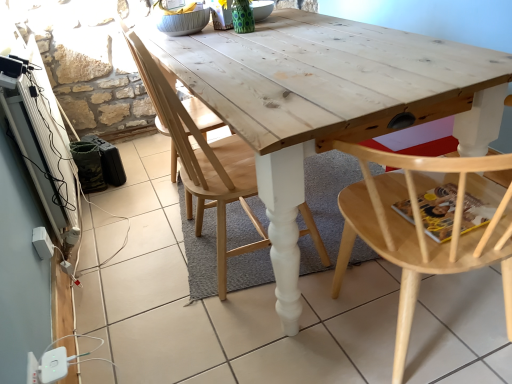
Identify the location of natural wood table at center. Image resolution: width=512 pixels, height=384 pixels. (328, 101).

At what (x,y) coordinates should I click in order to perform the action: click on natural wood chair at center, which is the second chair in right-to-left order. Please return your answer as a coordinate pair (x, y). This screenshot has width=512, height=384. Looking at the image, I should click on (203, 163).

Is natural wood chair at center, which ranks as the third chair in left-to-right order, at the back of natural wood table at center?

No, natural wood table at center's orientation is not away from natural wood chair at center, which ranks as the third chair in left-to-right order.

Does natural wood table at center have a greater height compared to natural wood chair at center, which ranks as the third chair in left-to-right order?

No, natural wood table at center is not taller than natural wood chair at center, which ranks as the third chair in left-to-right order.

What's the angular difference between natural wood table at center and natural wood chair at center, which ranks as the third chair in left-to-right order,'s facing directions?

The facing directions of natural wood table at center and natural wood chair at center, which ranks as the third chair in left-to-right order, are 89.8 degrees apart.

From a real-world perspective, is natural wood table at center positioned under natural wood chair at center, acting as the 1th chair starting from the right, based on gravity?

Correct, in the physical world, natural wood table at center is lower than natural wood chair at center, acting as the 1th chair starting from the right.

From a real-world perspective, who is located lower, natural wood chair at center, which appears as the 2th chair when viewed from the left, or natural wood table at center?

natural wood table at center, from a real-world perspective.

Is natural wood chair at center, which appears as the 2th chair when viewed from the left, further to the viewer compared to natural wood table at center?

Yes, natural wood chair at center, which appears as the 2th chair when viewed from the left, is further from the viewer.

From the image's perspective, relative to natural wood table at center, is natural wood chair at center, which is the second chair in right-to-left order, above or below?

From the image's perspective, natural wood chair at center, which is the second chair in right-to-left order, appears above natural wood table at center.

Who is taller, natural wood chair at center, positioned as the 3th chair in right-to-left order, or natural wood chair at center, which appears as the 2th chair when viewed from the left?

natural wood chair at center, positioned as the 3th chair in right-to-left order.

Is natural wood chair at center, placed as the first chair when sorted from left to right, located outside natural wood chair at center, which is the second chair in right-to-left order?

Absolutely, natural wood chair at center, placed as the first chair when sorted from left to right, is external to natural wood chair at center, which is the second chair in right-to-left order.

Are natural wood chair at center, placed as the first chair when sorted from left to right, and natural wood chair at center, which appears as the 2th chair when viewed from the left, located far from each other?

They are positioned close to each other.

From a real-world perspective, is natural wood chair at center, placed as the first chair when sorted from left to right, positioned over natural wood chair at center, which is the second chair in right-to-left order, based on gravity?

No.

From a real-world perspective, is natural wood chair at center, which ranks as the third chair in left-to-right order, above or below natural wood chair at center, which appears as the 2th chair when viewed from the left?

In terms of real-world spatial position, natural wood chair at center, which ranks as the third chair in left-to-right order, is below natural wood chair at center, which appears as the 2th chair when viewed from the left.

Is natural wood chair at center, acting as the 1th chair starting from the right, situated inside natural wood chair at center, which is the second chair in right-to-left order, or outside?

The correct answer is: outside.

Considering the sizes of objects natural wood chair at center, which ranks as the third chair in left-to-right order, and natural wood chair at center, which is the second chair in right-to-left order, in the image provided, who is taller, natural wood chair at center, which ranks as the third chair in left-to-right order, or natural wood chair at center, which is the second chair in right-to-left order,?

natural wood chair at center, which is the second chair in right-to-left order.

What's the angular difference between natural wood chair at center, acting as the 1th chair starting from the right, and natural wood chair at center, which appears as the 2th chair when viewed from the left,'s facing directions?

The facing directions of natural wood chair at center, acting as the 1th chair starting from the right, and natural wood chair at center, which appears as the 2th chair when viewed from the left, are 90 degrees apart.

Measure the distance between natural wood chair at center, which appears as the 2th chair when viewed from the left, and natural wood chair at center, placed as the first chair when sorted from left to right.

natural wood chair at center, which appears as the 2th chair when viewed from the left, is 7.48 inches away from natural wood chair at center, placed as the first chair when sorted from left to right.

Looking at the image, does natural wood chair at center, which is the second chair in right-to-left order, seem bigger or smaller compared to natural wood chair at center, placed as the first chair when sorted from left to right?

Clearly, natural wood chair at center, which is the second chair in right-to-left order, is smaller in size than natural wood chair at center, placed as the first chair when sorted from left to right.

Is natural wood chair at center, which is the second chair in right-to-left order, not near natural wood chair at center, placed as the first chair when sorted from left to right?

No, natural wood chair at center, which is the second chair in right-to-left order, is not far from natural wood chair at center, placed as the first chair when sorted from left to right.

Is natural wood chair at center, which is the second chair in right-to-left order, in front of or behind natural wood chair at center, positioned as the 3th chair in right-to-left order, in the image?

In the image, natural wood chair at center, which is the second chair in right-to-left order, appears in front of natural wood chair at center, positioned as the 3th chair in right-to-left order.

Considering the positions of objects natural wood table at center and natural wood chair at center, which is the second chair in right-to-left order, in the image provided, who is more to the left, natural wood table at center or natural wood chair at center, which is the second chair in right-to-left order,?

natural wood table at center is more to the left.

Is point (278, 266) less distant than point (144, 65)?

Yes, it is in front of point (144, 65).

Is natural wood table at center completely or partially outside of natural wood chair at center, which is the second chair in right-to-left order?

Yes, natural wood table at center is not within natural wood chair at center, which is the second chair in right-to-left order.

Is natural wood table at center closer to the viewer compared to natural wood chair at center, which is the second chair in right-to-left order?

Yes.

Consider the image. Which object is positioned more to the left, natural wood table at center or natural wood chair at center, positioned as the 3th chair in right-to-left order?

From the viewer's perspective, natural wood chair at center, positioned as the 3th chair in right-to-left order, appears more on the left side.

Is natural wood table at center positioned beyond the bounds of natural wood chair at center, placed as the first chair when sorted from left to right?

Yes, natural wood table at center is outside of natural wood chair at center, placed as the first chair when sorted from left to right.

Are natural wood table at center and natural wood chair at center, placed as the first chair when sorted from left to right, far apart?

No, natural wood table at center is not far away from natural wood chair at center, placed as the first chair when sorted from left to right.

Can you confirm if natural wood table at center is thinner than natural wood chair at center, positioned as the 3th chair in right-to-left order?

No.

Locate an element on the screen. This screenshot has width=512, height=384. table lying on the left of natural wood chair at center, acting as the 1th chair starting from the right is located at coordinates (328, 101).

Locate an element on the screen. chair that is the 1st one when counting rightward from the natural wood table at center is located at coordinates (203, 163).

Looking at the image, which one is located further to natural wood chair at center, which ranks as the third chair in left-to-right order, natural wood chair at center, placed as the first chair when sorted from left to right, or natural wood chair at center, which appears as the 2th chair when viewed from the left?

natural wood chair at center, placed as the first chair when sorted from left to right.

From the picture: When comparing their distances from natural wood chair at center, positioned as the 3th chair in right-to-left order, does natural wood chair at center, which appears as the 2th chair when viewed from the left, or natural wood table at center seem closer?

natural wood chair at center, which appears as the 2th chair when viewed from the left.

Considering their positions, is natural wood chair at center, which is the second chair in right-to-left order, positioned further to natural wood table at center than natural wood chair at center, placed as the first chair when sorted from left to right?

natural wood chair at center, placed as the first chair when sorted from left to right, is further to natural wood table at center.

When comparing their distances from natural wood chair at center, which is the second chair in right-to-left order, does natural wood chair at center, which ranks as the third chair in left-to-right order, or natural wood chair at center, positioned as the 3th chair in right-to-left order, seem closer?

The object closer to natural wood chair at center, which is the second chair in right-to-left order, is natural wood chair at center, positioned as the 3th chair in right-to-left order.

Looking at the image, which one is located closer to natural wood chair at center, positioned as the 3th chair in right-to-left order, natural wood chair at center, which is the second chair in right-to-left order, or natural wood chair at center, acting as the 1th chair starting from the right?

Based on the image, natural wood chair at center, which is the second chair in right-to-left order, appears to be nearer to natural wood chair at center, positioned as the 3th chair in right-to-left order.

Based on their spatial positions, is natural wood chair at center, positioned as the 3th chair in right-to-left order, or natural wood table at center further from natural wood chair at center, which ranks as the third chair in left-to-right order?

The object further to natural wood chair at center, which ranks as the third chair in left-to-right order, is natural wood chair at center, positioned as the 3th chair in right-to-left order.

Estimate the real-world distances between objects in this image. Which object is further from natural wood chair at center, acting as the 1th chair starting from the right, natural wood table at center or natural wood chair at center, which appears as the 2th chair when viewed from the left?

natural wood chair at center, which appears as the 2th chair when viewed from the left, is positioned further to the anchor natural wood chair at center, acting as the 1th chair starting from the right.

Which object lies nearer to the anchor point natural wood chair at center, positioned as the 3th chair in right-to-left order, natural wood chair at center, acting as the 1th chair starting from the right, or natural wood chair at center, which is the second chair in right-to-left order?

Among the two, natural wood chair at center, which is the second chair in right-to-left order, is located nearer to natural wood chair at center, positioned as the 3th chair in right-to-left order.

The height and width of the screenshot is (384, 512). Identify the location of chair located between natural wood table at center and natural wood chair at center, acting as the 1th chair starting from the right, in the left-right direction. (203, 163).

I want to click on chair between natural wood table at center and natural wood chair at center, placed as the first chair when sorted from left to right, from front to back, so click(203, 163).

Identify the location of table between natural wood chair at center, which ranks as the third chair in left-to-right order, and natural wood chair at center, positioned as the 3th chair in right-to-left order, in the front-back direction. (328, 101).

This screenshot has width=512, height=384. I want to click on chair between natural wood chair at center, which ranks as the third chair in left-to-right order, and natural wood chair at center, placed as the first chair when sorted from left to right, from front to back, so click(x=203, y=163).